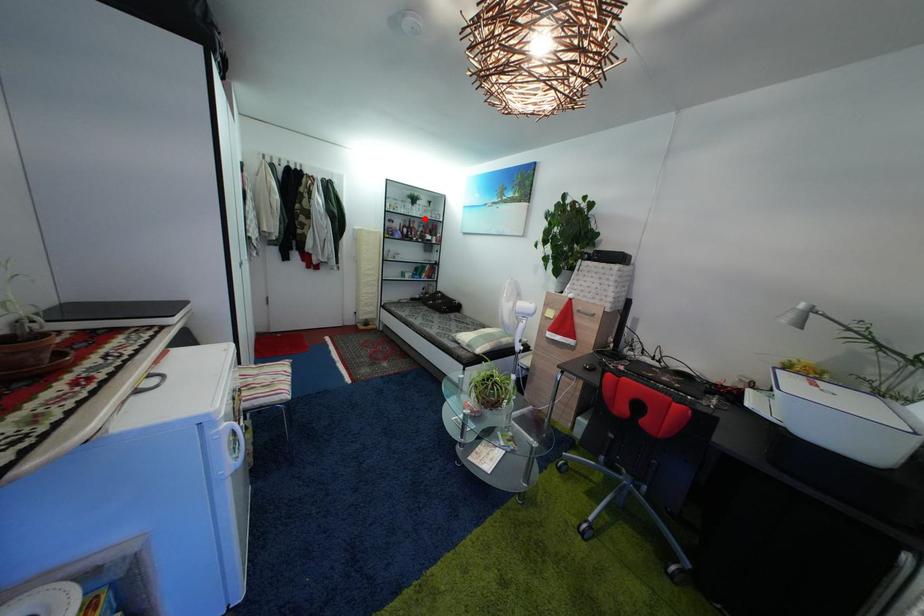
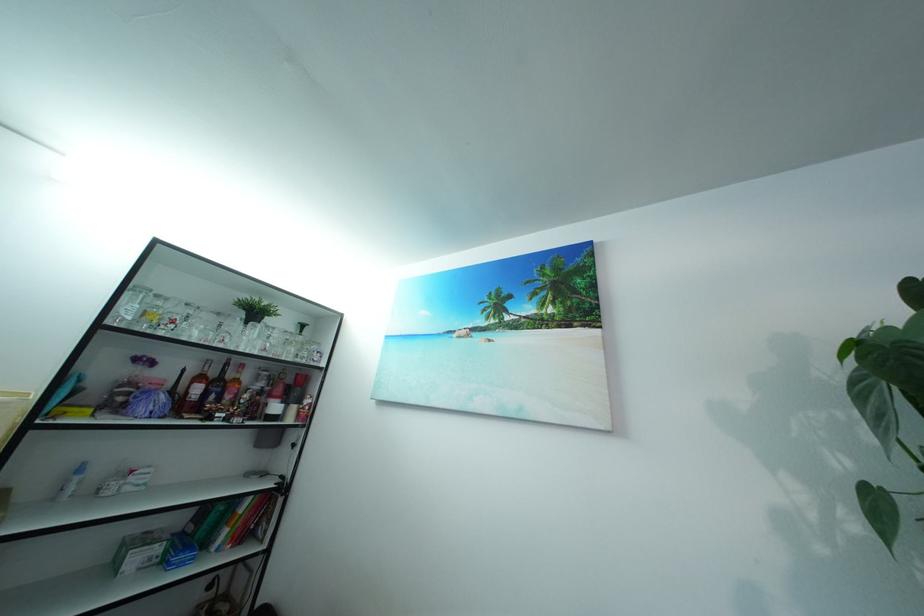
In the second image, find the point that corresponds to the highlighted location in the first image.

(257, 347)